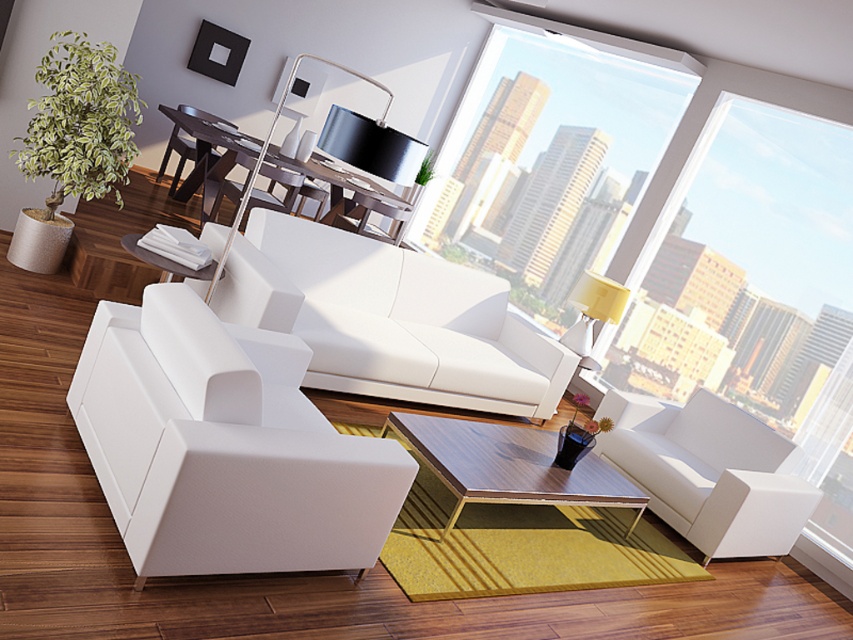
Who is positioned more to the left, white leather couch at center or matte white table at center?

matte white table at center is more to the left.

What do you see at coordinates (389, 320) in the screenshot? I see `white leather couch at center` at bounding box center [389, 320].

Between point (347, 296) and point (271, 145), which one is positioned in front?

Point (347, 296) is in front.

Locate an element on the screen. Image resolution: width=853 pixels, height=640 pixels. white leather couch at center is located at coordinates (x=389, y=320).

Which is more to the left, transparent glass window at center or matte white table at center?

From the viewer's perspective, matte white table at center appears more on the left side.

Is point (660, 284) less distant than point (173, 120)?

No, (660, 284) is behind (173, 120).

This screenshot has width=853, height=640. In order to click on transparent glass window at center in this screenshot , I will do [x=728, y=307].

How much distance is there between white leather armchair at lower right and matte white table at center?

The distance of white leather armchair at lower right from matte white table at center is 12.75 feet.

Which is in front, point (735, 509) or point (181, 198)?

Point (735, 509) is in front.

Identify the location of white leather armchair at lower right. This screenshot has height=640, width=853. (709, 472).